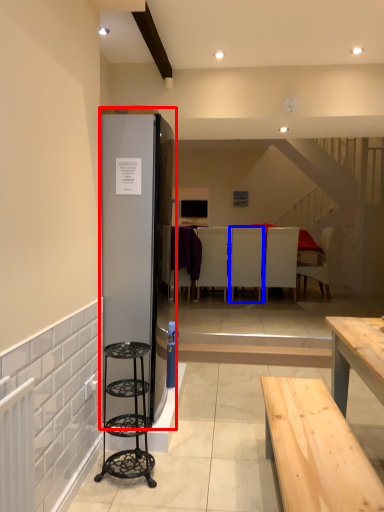
Question: Which object appears closest to the camera in this image, fridge (highlighted by a red box) or armchair (highlighted by a blue box)?

Choices:
 (A) fridge
 (B) armchair

Answer: (A)